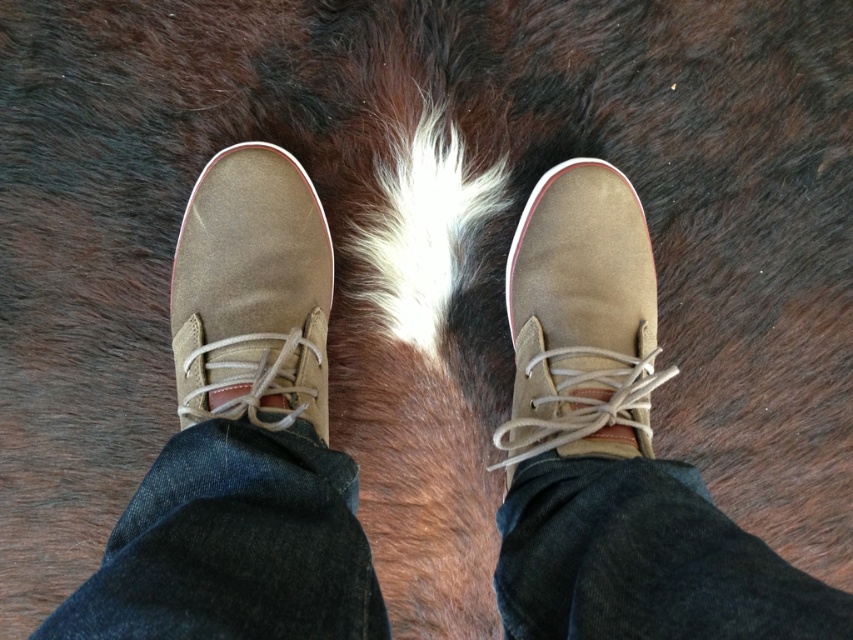
Which is in front, point (569, 365) or point (225, 212)?

Point (569, 365) is more forward.

Find the location of a particular element. suede/leather boot at center is located at coordinates (579, 320).

Does point (520, 275) come farther from viewer compared to point (187, 401)?

That is True.

Find the location of `suede/leather boot at center`. suede/leather boot at center is located at coordinates (579, 320).